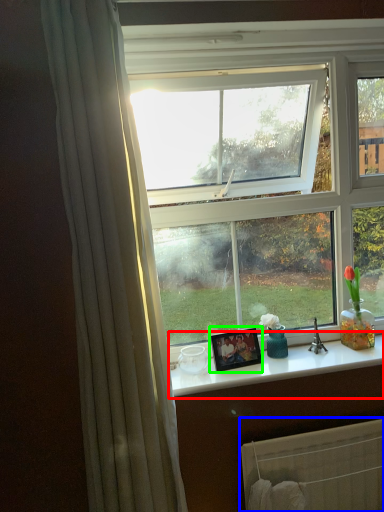
Question: Estimate the real-world distances between objects in this image. Which object is closer to counter top (highlighted by a red box), radiator (highlighted by a blue box) or picture frame (highlighted by a green box)?

Choices:
 (A) radiator
 (B) picture frame

Answer: (B)